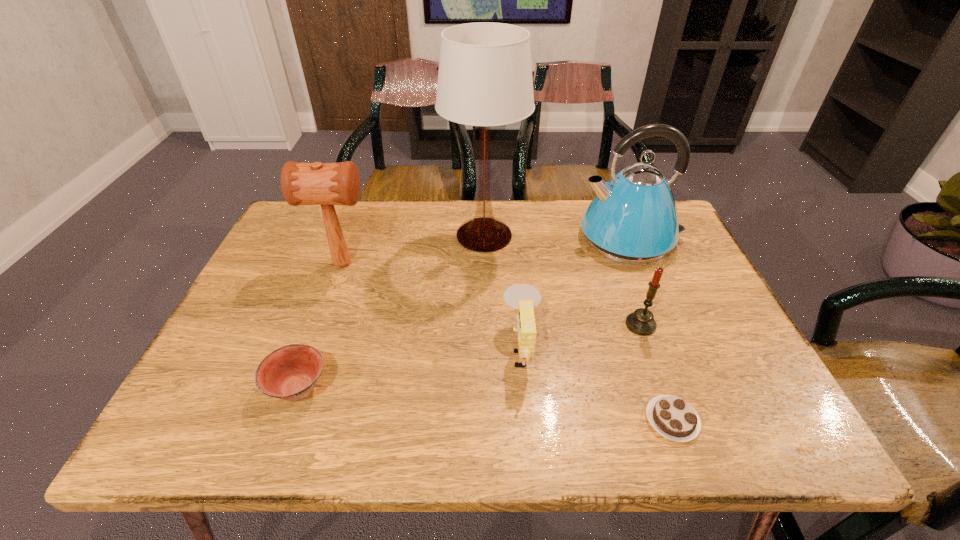
What are the coordinates of `vacant space at the near edge of the desktop` in the screenshot? It's located at (646, 424).

The height and width of the screenshot is (540, 960). I want to click on vacant space at the left edge of the desktop, so coord(285,318).

Identify the location of free region at the right edge of the desktop. (686, 264).

Where is `vacant space at the far left corner`? Image resolution: width=960 pixels, height=540 pixels. vacant space at the far left corner is located at coordinates (302, 246).

I want to click on free space that is in between the chocolate cake and the mallet, so click(x=508, y=342).

Where is `free area in between the fifth tallest object and the candle`? The image size is (960, 540). free area in between the fifth tallest object and the candle is located at coordinates (581, 336).

What are the coordinates of `free space between the sponge and the fourth shortest object` in the screenshot? It's located at (581, 336).

This screenshot has height=540, width=960. Find the location of `free spot between the tallest object and the sponge`. free spot between the tallest object and the sponge is located at coordinates (503, 292).

Image resolution: width=960 pixels, height=540 pixels. Identify the location of free space between the chocolate cake and the tallest object. (578, 328).

Identify the location of vacant area that lies between the candle and the mallet. (492, 294).